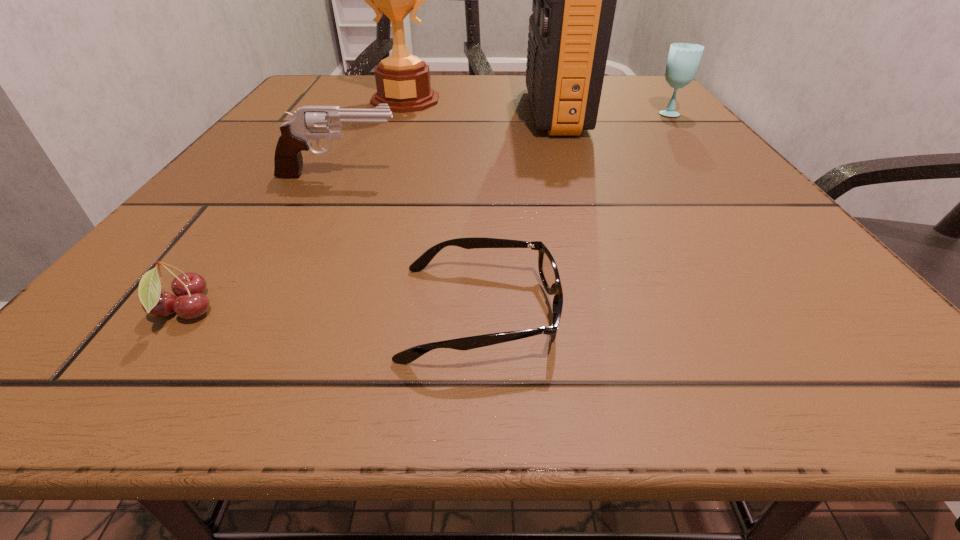
Identify the location of gun positioned at the left edge. (308, 122).

Where is `cherry that is positioned at the left edge`? cherry that is positioned at the left edge is located at coordinates (190, 303).

You are a GUI agent. You are given a task and a screenshot of the screen. Output one action in this format:
    pyautogui.click(x=<x>, y=<y>)
    Task: Click on the object present at the right edge
    This screenshot has height=540, width=960.
    Given the screenshot: What is the action you would take?
    [683, 60]

What are the coordinates of `object that is at the far left corner` in the screenshot? It's located at (403, 81).

This screenshot has width=960, height=540. Identify the location of object at the near left corner. (190, 303).

This screenshot has width=960, height=540. In order to click on object situated at the far right corner in this screenshot , I will do (x=683, y=60).

The height and width of the screenshot is (540, 960). In the image, there is a desktop. Find the location of `vacant space at the far edge`. vacant space at the far edge is located at coordinates (443, 79).

You are a GUI agent. You are given a task and a screenshot of the screen. Output one action in this format:
    pyautogui.click(x=<x>, y=<y>)
    Task: Click on the vacant space at the near edge of the desktop
    The height and width of the screenshot is (540, 960).
    Given the screenshot: What is the action you would take?
    pyautogui.click(x=362, y=320)

You are a GUI agent. You are given a task and a screenshot of the screen. Output one action in this format:
    pyautogui.click(x=<x>, y=<y>)
    Task: Click on the vacant space at the left edge of the desktop
    The image size is (960, 540).
    Given the screenshot: What is the action you would take?
    coord(215,179)

Locate an element on the screen. free region at the right edge is located at coordinates (675, 171).